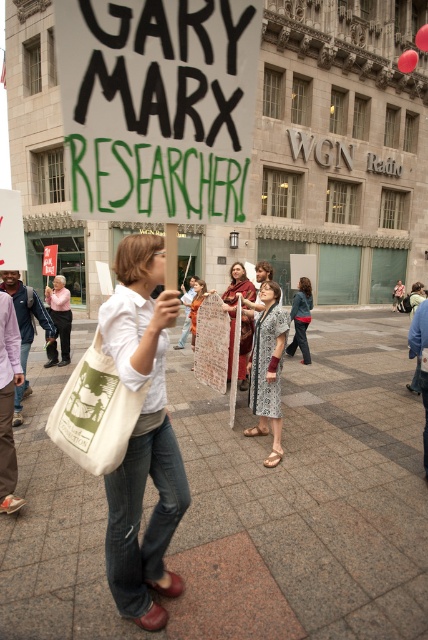
Does point (273, 353) come behind point (50, 355)?

No, it is in front of (50, 355).

Which of these two, patterned fabric dress at center or matte pink shirt at center, stands shorter?

matte pink shirt at center

Between point (261, 291) and point (59, 364), which one is positioned behind?

The point (59, 364) is more distant.

Where is `patterned fabric dress at center`? The image size is (428, 640). patterned fabric dress at center is located at coordinates (267, 369).

Does patterned fabric dress at center appear on the left side of matte white shirt at center?

In fact, patterned fabric dress at center is to the right of matte white shirt at center.

Does point (262, 310) come behind point (193, 308)?

No, (262, 310) is in front of (193, 308).

Locate an element on the screen. The width and height of the screenshot is (428, 640). patterned fabric dress at center is located at coordinates (267, 369).

Between point (53, 321) and point (199, 300), which one is positioned in front?

Point (199, 300) is in front.

Is matte pink shirt at center to the left of matte white shirt at center from the viewer's perspective?

Indeed, matte pink shirt at center is positioned on the left side of matte white shirt at center.

Which is in front, point (59, 292) or point (193, 339)?

Point (59, 292) is more forward.

This screenshot has height=640, width=428. Find the location of `matte pink shirt at center`. matte pink shirt at center is located at coordinates (59, 321).